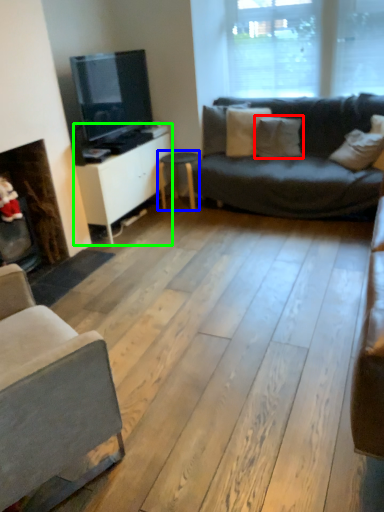
Question: Which is farther away from pillow (highlighted by a red box)? table (highlighted by a blue box) or cabinetry (highlighted by a green box)?

Choices:
 (A) table
 (B) cabinetry

Answer: (B)